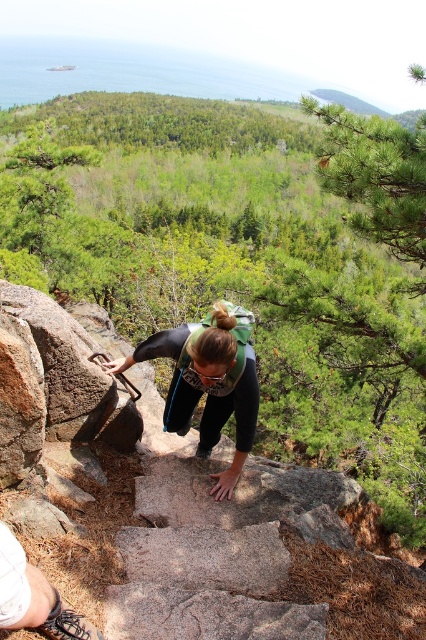
Question: Which of the following is the closest to the observer?

Choices:
 (A) (221, 339)
 (B) (37, 353)

Answer: (A)

Question: Does granite steps at center appear on the right side of matte black pants at center?

Choices:
 (A) no
 (B) yes

Answer: (B)

Question: Among these points, which one is nearest to the camera?

Choices:
 (A) (336, 541)
 (B) (221, 419)

Answer: (A)

Question: Is granite steps at center further to camera compared to matte black pants at center?

Choices:
 (A) no
 (B) yes

Answer: (A)

Question: In this image, where is granite steps at center located relative to matte black pants at center?

Choices:
 (A) right
 (B) left

Answer: (A)